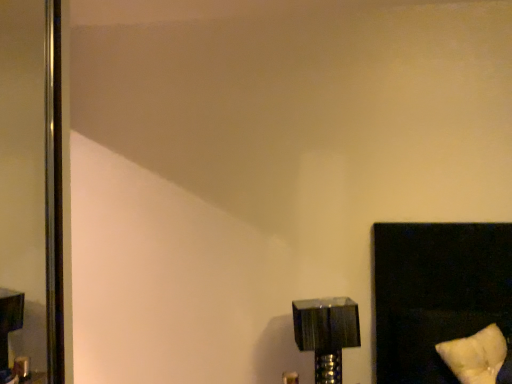
Question: Is metallic silver lamp at lower right far from polished metallic screen door at left?

Choices:
 (A) no
 (B) yes

Answer: (B)

Question: Considering the relative positions of metallic silver lamp at lower right and polished metallic screen door at left in the image provided, is metallic silver lamp at lower right in front of polished metallic screen door at left?

Choices:
 (A) no
 (B) yes

Answer: (B)

Question: From the image's perspective, is metallic silver lamp at lower right above polished metallic screen door at left?

Choices:
 (A) yes
 (B) no

Answer: (B)

Question: Is metallic silver lamp at lower right wider than polished metallic screen door at left?

Choices:
 (A) yes
 (B) no

Answer: (A)

Question: Would you say metallic silver lamp at lower right contains polished metallic screen door at left?

Choices:
 (A) yes
 (B) no

Answer: (B)

Question: From the image's perspective, is polished metallic screen door at left positioned above or below metallic silver lamp at lower right?

Choices:
 (A) below
 (B) above

Answer: (B)

Question: In terms of width, does polished metallic screen door at left look wider or thinner when compared to metallic silver lamp at lower right?

Choices:
 (A) wide
 (B) thin

Answer: (B)

Question: Which is correct: polished metallic screen door at left is inside metallic silver lamp at lower right, or outside of it?

Choices:
 (A) inside
 (B) outside

Answer: (B)

Question: Looking at the image, does polished metallic screen door at left seem bigger or smaller compared to metallic silver lamp at lower right?

Choices:
 (A) big
 (B) small

Answer: (A)

Question: Considering their positions, is white soft pillow at lower right located in front of or behind metallic silver lamp at lower right?

Choices:
 (A) front
 (B) behind

Answer: (A)

Question: Is point (458, 345) positioned closer to the camera than point (330, 332)?

Choices:
 (A) farther
 (B) closer

Answer: (B)

Question: Looking at their shapes, would you say white soft pillow at lower right is wider or thinner than metallic silver lamp at lower right?

Choices:
 (A) thin
 (B) wide

Answer: (B)

Question: From their relative heights in the image, would you say white soft pillow at lower right is taller or shorter than metallic silver lamp at lower right?

Choices:
 (A) short
 (B) tall

Answer: (A)

Question: Is metallic silver lamp at lower right taller or shorter than polished metallic screen door at left?

Choices:
 (A) short
 (B) tall

Answer: (A)

Question: Is point (305, 349) closer or farther from the camera than point (25, 182)?

Choices:
 (A) closer
 (B) farther

Answer: (A)